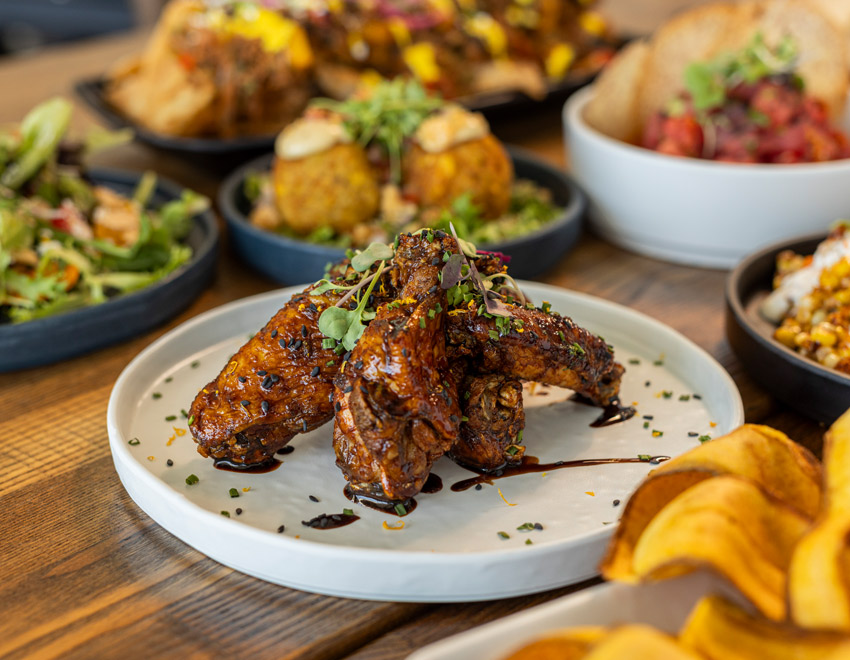
Where is `white dishes`? white dishes is located at coordinates (635, 345), (676, 216).